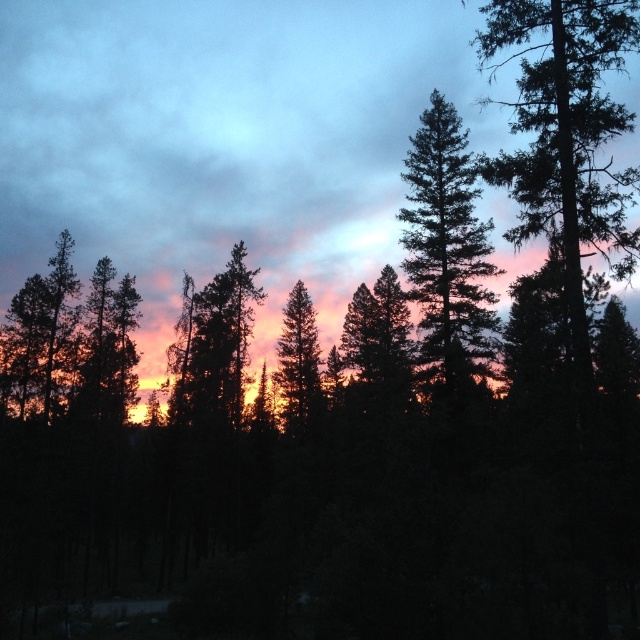
Who is more forward, (x=236, y=300) or (x=291, y=378)?

Point (x=236, y=300)

Does silhouette pine tree at center have a lesser height compared to green matte tree at center?

Incorrect, silhouette pine tree at center's height does not fall short of green matte tree at center's.

Is point (172, 396) closer to viewer compared to point (298, 330)?

No, it is behind (298, 330).

Identify the location of silhouette pine tree at center. The width and height of the screenshot is (640, 640). (212, 344).

Between point (445, 106) and point (252, 272), which one is positioned in front?

Point (445, 106) is more forward.

Can you confirm if green textured pine tree at center is smaller than silhouette pine tree at center?

No.

Between point (461, 282) and point (202, 381), which one is positioned in front?

Positioned in front is point (461, 282).

Where is `green textured pine tree at center`? The height and width of the screenshot is (640, 640). green textured pine tree at center is located at coordinates (448, 252).

Is point (525, 20) closer to camera compared to point (220, 392)?

Yes, point (525, 20) is in front of point (220, 392).

I want to click on green textured tree at upper right, so click(x=566, y=138).